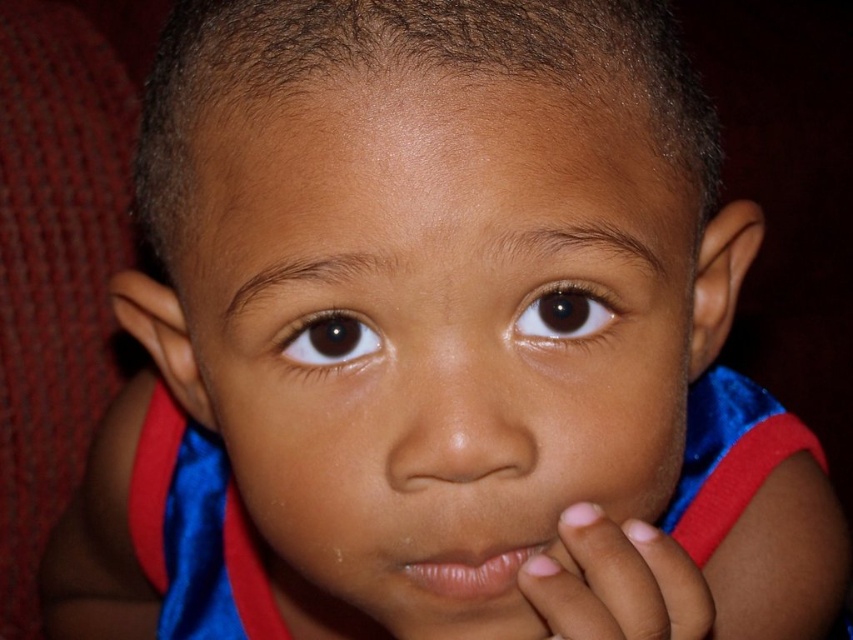
You are a photographer adjusting the focus of your camera. You notice two points in the image at coordinates point (219, 177) and point (581, 304). Which point should you focus on first if you want to ensure the child is in sharp focus?

Point (219, 177) is in front of point (581, 304). Since the child is the main subject, focusing on the closer point (219, 177) will help ensure the child is in sharp focus.

Based on the scene description, can you determine which object is closer to the viewer between the smooth skin hand at lower center and the smooth skin nose at center?

The smooth skin nose at center is behind the smooth skin hand at lower center, so the hand is closer to the viewer.

Looking at the child in the image, which object is positioned lower on their face between the smooth skin nose at center and the brown shiny eye at center?

The smooth skin nose at center is located below the brown shiny eye at center, so the nose is positioned lower on the face.